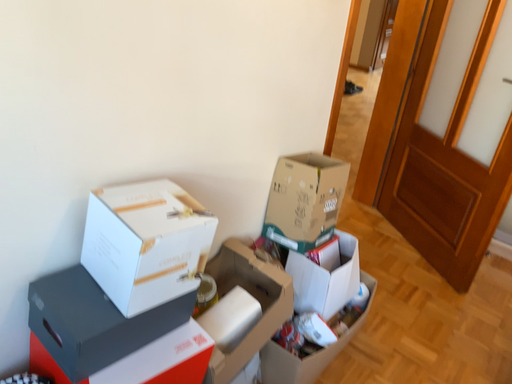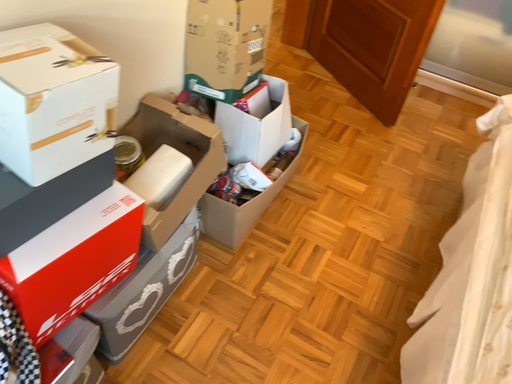
Question: How did the camera likely rotate when shooting the video?

Choices:
 (A) rotated downward
 (B) rotated upward

Answer: (A)